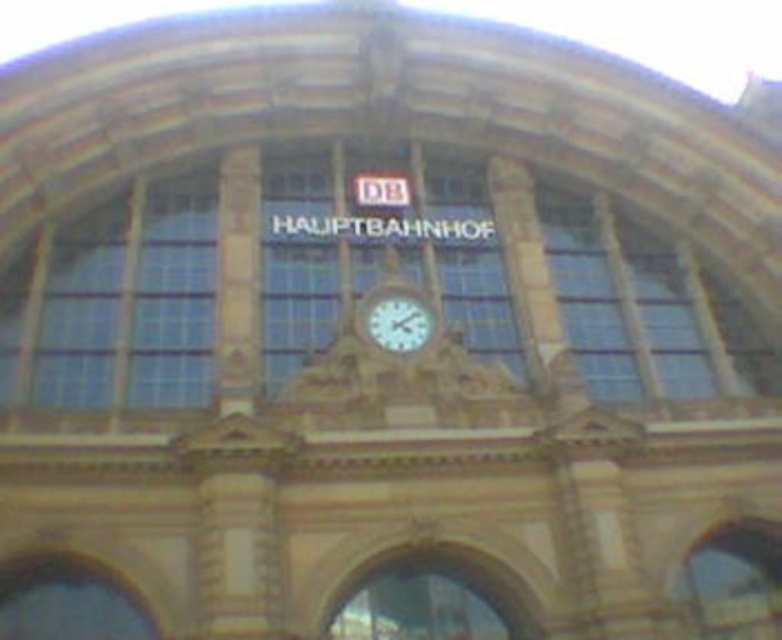
Question: Does clear glass window at center appear over white glossy clock at center?

Choices:
 (A) yes
 (B) no

Answer: (A)

Question: Does clear glass window at left come behind white glossy clock at center?

Choices:
 (A) no
 (B) yes

Answer: (A)

Question: Is clear glass window at center smaller than white glossy clock at center?

Choices:
 (A) no
 (B) yes

Answer: (A)

Question: Considering the real-world distances, which object is closest to the clear glass window at center?

Choices:
 (A) white glossy clock at center
 (B) clear glass window at left

Answer: (B)

Question: Which of the following is the farthest from the observer?

Choices:
 (A) (407, 333)
 (B) (146, 330)
 (C) (339, 218)

Answer: (C)

Question: Among these points, which one is farthest from the camera?

Choices:
 (A) (323, 324)
 (B) (382, 337)

Answer: (A)